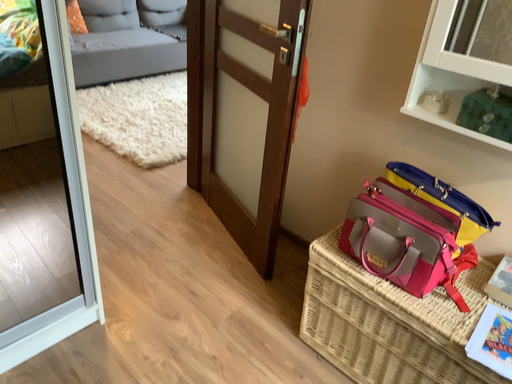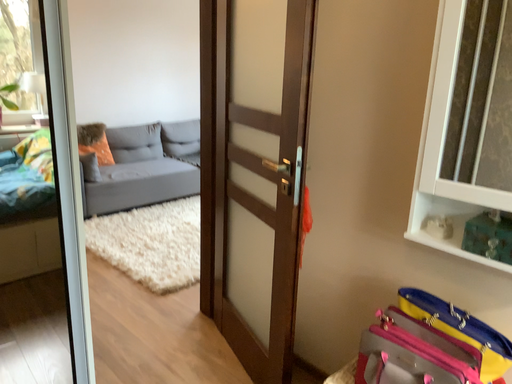
Question: How did the camera likely rotate when shooting the video?

Choices:
 (A) rotated upward
 (B) rotated downward

Answer: (A)